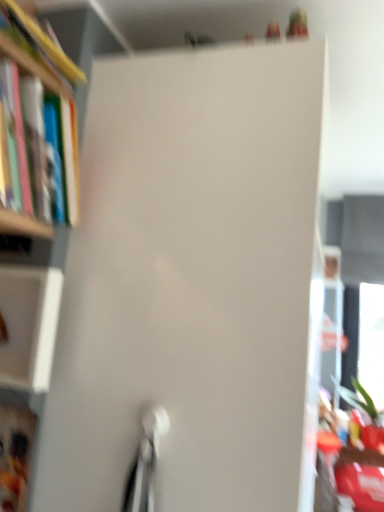
Question: Would you say white matte cabinet at left, placed as the first cabinet when sorted from top to bottom, is to the left or to the right of hardcover book at left, which is the second book from bottom to top, in the picture?

Choices:
 (A) right
 (B) left

Answer: (B)

Question: In the image, is white matte cabinet at left, the second cabinet from the bottom, positioned in front of or behind hardcover book at left, acting as the 1th book starting from the top?

Choices:
 (A) front
 (B) behind

Answer: (B)

Question: Which object is the farthest from the hardcover book at left, which is the second book from bottom to top?

Choices:
 (A) white matte cabinet at left, the second cabinet from the bottom
 (B) matte plastic cabinet at lower left, which appears as the 1th cabinet when ordered from the bottom
 (C) hardcover book at left, which is counted as the 1th book, starting from the bottom

Answer: (B)

Question: Which of these objects is positioned closest to the hardcover book at left, which is counted as the 1th book, starting from the bottom?

Choices:
 (A) white matte cabinet at left, the second cabinet from the bottom
 (B) matte plastic cabinet at lower left, the second cabinet from the top
 (C) hardcover book at left, acting as the 1th book starting from the top

Answer: (C)